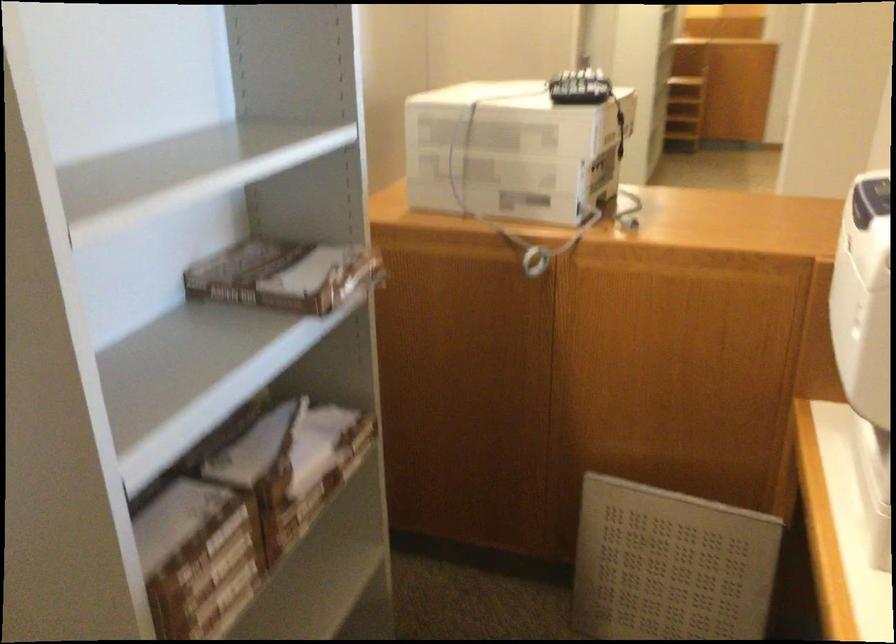
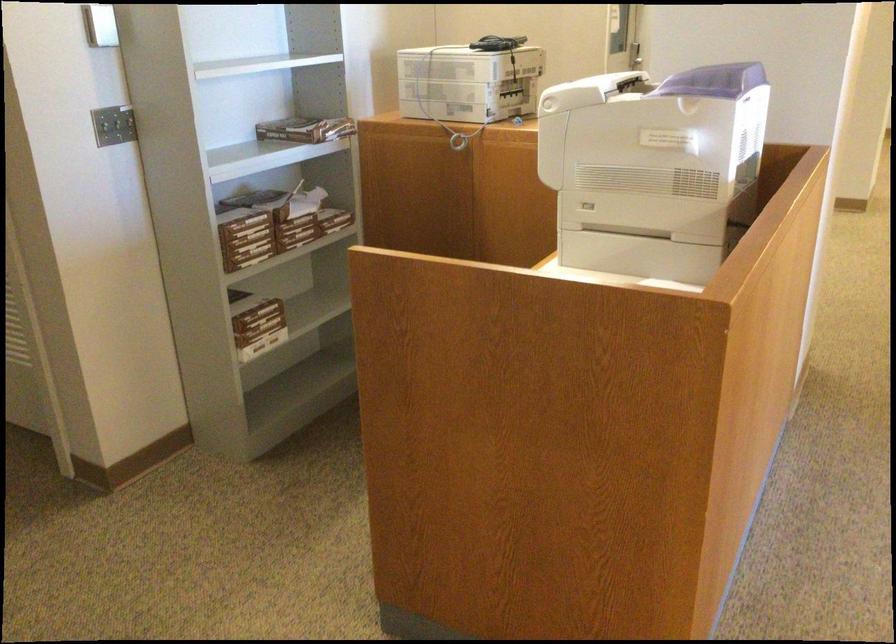
Find the pixel in the second image that matches pixel 307 303 in the first image.

(306, 129)